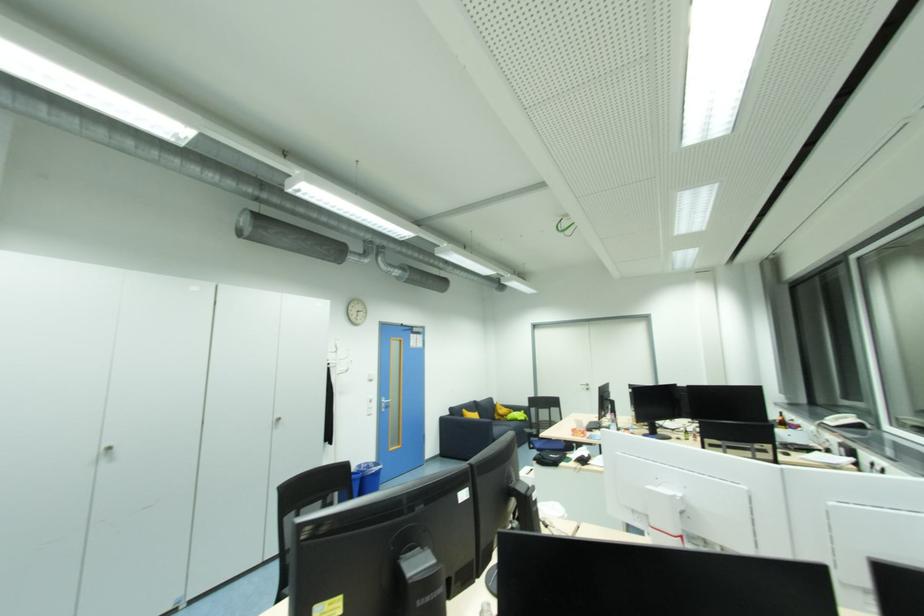
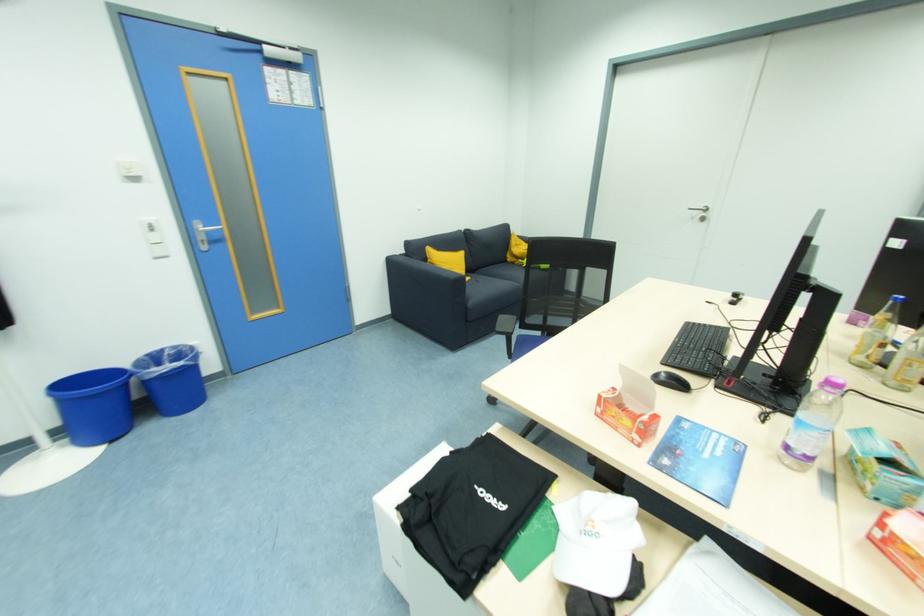
In the second image, find the point that corresponds to (590,391) in the first image.

(706, 221)